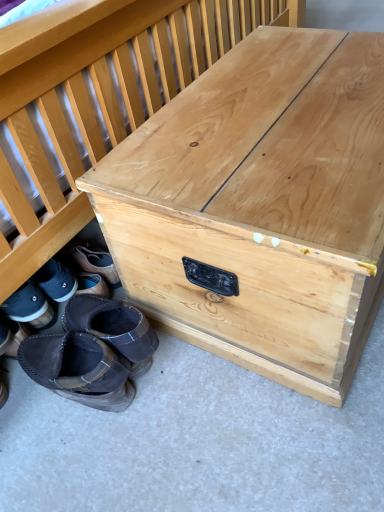
Question: Is black suede boot at lower left, marked as the fourth footwear in a right-to-left arrangement, completely or partially outside of dark brown suede moccasin at lower left, the fifth footwear in the left-to-right sequence?

Choices:
 (A) no
 (B) yes

Answer: (B)

Question: Does black suede boot at lower left, the second footwear in the left-to-right sequence, touch dark brown suede moccasin at lower left, the fifth footwear in the left-to-right sequence?

Choices:
 (A) no
 (B) yes

Answer: (A)

Question: Is black suede boot at lower left, the second footwear in the left-to-right sequence, thinner than dark brown suede moccasin at lower left, the fifth footwear in the left-to-right sequence?

Choices:
 (A) no
 (B) yes

Answer: (B)

Question: Does black suede boot at lower left, the second footwear in the left-to-right sequence, have a larger size compared to dark brown suede moccasin at lower left, which appears as the first footwear when viewed from the right?

Choices:
 (A) no
 (B) yes

Answer: (A)

Question: Does black suede boot at lower left, the second footwear in the left-to-right sequence, contain dark brown suede moccasin at lower left, which appears as the first footwear when viewed from the right?

Choices:
 (A) yes
 (B) no

Answer: (B)

Question: Is black suede boot at lower left, the second footwear in the left-to-right sequence, oriented away from dark brown suede moccasin at lower left, the fifth footwear in the left-to-right sequence?

Choices:
 (A) no
 (B) yes

Answer: (B)

Question: Is brown suede boot at lower left, acting as the 5th footwear starting from the right, to the right of brown suede boot at lower left, the 2th footwear positioned from the right, from the viewer's perspective?

Choices:
 (A) no
 (B) yes

Answer: (A)

Question: Is brown suede boot at lower left, the 1th footwear from the left, positioned far away from brown suede boot at lower left, the 2th footwear positioned from the right?

Choices:
 (A) yes
 (B) no

Answer: (B)

Question: Could you tell me if brown suede boot at lower left, the 1th footwear from the left, is facing brown suede boot at lower left, the 2th footwear positioned from the right?

Choices:
 (A) no
 (B) yes

Answer: (A)

Question: Is brown suede boot at lower left, acting as the 5th footwear starting from the right, beside brown suede boot at lower left, the fourth footwear in the left-to-right sequence?

Choices:
 (A) no
 (B) yes

Answer: (A)

Question: Is brown suede boot at lower left, the 1th footwear from the left, taller than brown suede boot at lower left, the 2th footwear positioned from the right?

Choices:
 (A) yes
 (B) no

Answer: (A)

Question: From a real-world perspective, is brown suede boot at lower left, acting as the 5th footwear starting from the right, under brown suede boot at lower left, the fourth footwear in the left-to-right sequence?

Choices:
 (A) no
 (B) yes

Answer: (A)

Question: Is leather boots at lower left, positioned as the third footwear in right-to-left order, to the left of natural wood trunk at center from the viewer's perspective?

Choices:
 (A) yes
 (B) no

Answer: (A)